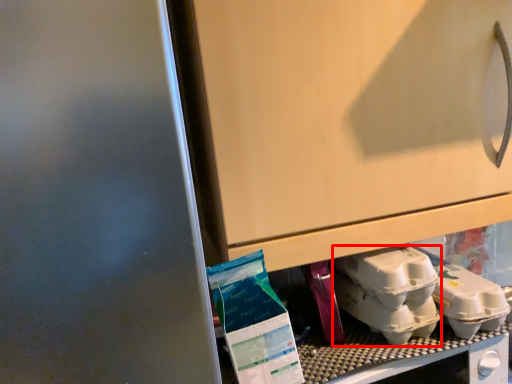
Question: From the image's perspective, considering the relative positions of yoghurt (annotated by the red box) and yoghurt in the image provided, where is yoghurt (annotated by the red box) located with respect to the staircase?

Choices:
 (A) above
 (B) below

Answer: (B)